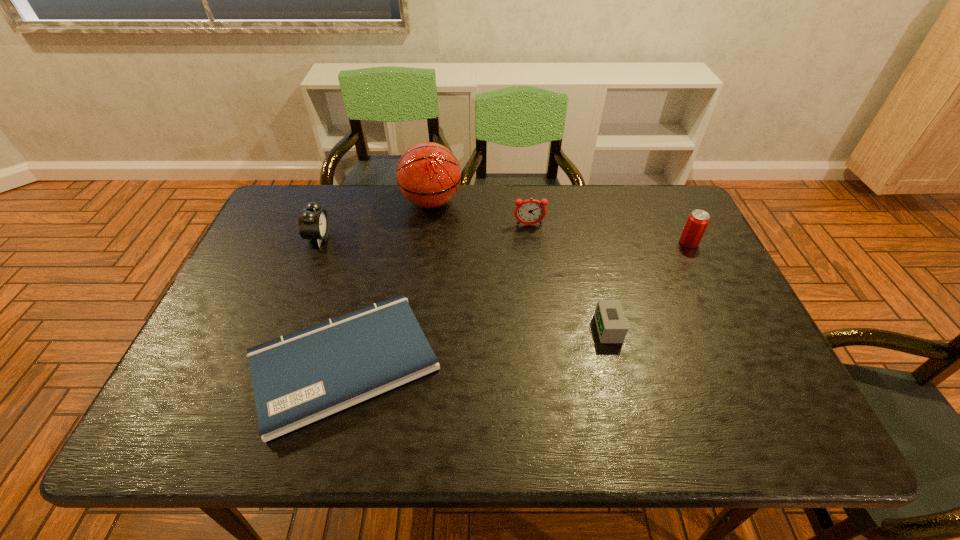
Where is `vacant space located 0.130m on the left of the can`? vacant space located 0.130m on the left of the can is located at coordinates (636, 243).

Locate an element on the screen. The height and width of the screenshot is (540, 960). free space located on the front-facing side of the second alarm clock from left to right is located at coordinates tap(540, 307).

Find the location of a particular element. This screenshot has height=540, width=960. free space located on the front-facing side of the shortest alarm clock is located at coordinates (532, 328).

I want to click on vacant region located on the front-facing side of the shortest alarm clock, so click(561, 328).

At what (x,y) coordinates should I click in order to perform the action: click on free space located 0.170m on the front-facing side of the shortest alarm clock. Please return your answer as a coordinate pair (x, y). Looking at the image, I should click on (528, 328).

Identify the location of free space located on the right of the paperback book. (580, 362).

Locate an element on the screen. This screenshot has height=540, width=960. basketball located in the far edge section of the desktop is located at coordinates (428, 174).

Find the location of a particular element. object that is at the near edge is located at coordinates (302, 377).

You are a GUI agent. You are given a task and a screenshot of the screen. Output one action in this format:
    pyautogui.click(x=<x>, y=<y>)
    Task: Click on the alarm clock at the left edge
    The height and width of the screenshot is (540, 960).
    Given the screenshot: What is the action you would take?
    pyautogui.click(x=313, y=223)

You are a GUI agent. You are given a task and a screenshot of the screen. Output one action in this format:
    pyautogui.click(x=<x>, y=<y>)
    Task: Click on the paperback book situated at the left edge
    The width and height of the screenshot is (960, 540).
    Given the screenshot: What is the action you would take?
    pyautogui.click(x=302, y=377)